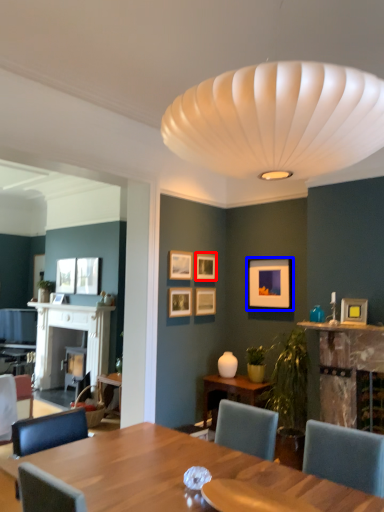
Question: Which point is further to the camera, picture frame (highlighted by a red box) or picture frame (highlighted by a blue box)?

Choices:
 (A) picture frame
 (B) picture frame

Answer: (A)